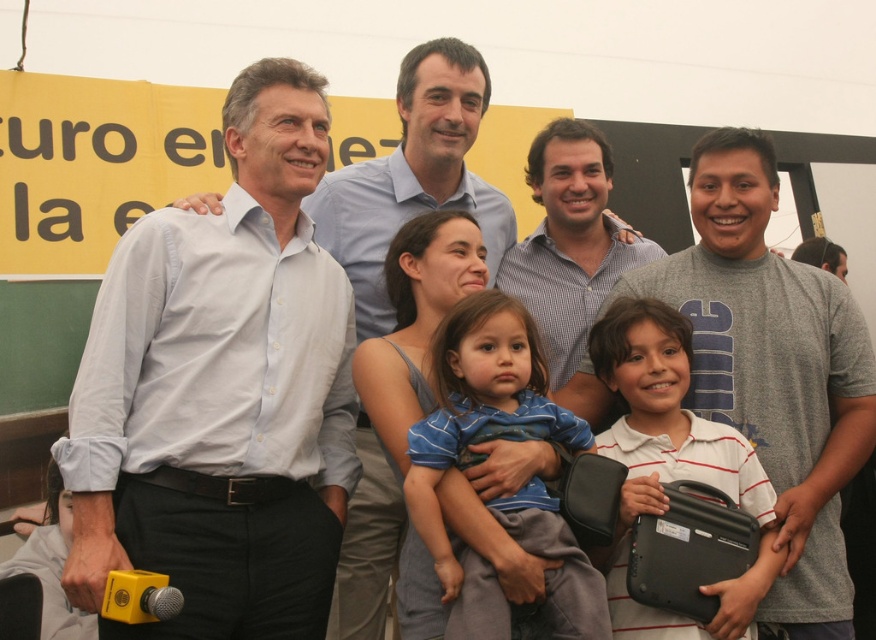
Question: Is white striped polo shirt at center further to the viewer compared to black matte briefcase at lower right?

Choices:
 (A) yes
 (B) no

Answer: (B)

Question: Is light blue shirt at center in front of gray cotton t-shirt at center?

Choices:
 (A) no
 (B) yes

Answer: (B)

Question: Which point is closer to the camera?

Choices:
 (A) white striped polo shirt at center
 (B) black matte briefcase at lower right

Answer: (A)

Question: Estimate the real-world distances between objects in this image. Which object is closer to the white shirt at center?

Choices:
 (A) white striped polo shirt at center
 (B) light blue shirt at center
 (C) checkered shirt at center
 (D) black matte briefcase at lower right

Answer: (C)

Question: Is light blue shirt at center smaller than black matte briefcase at lower right?

Choices:
 (A) yes
 (B) no

Answer: (B)

Question: Estimate the real-world distances between objects in this image. Which object is closer to the white striped polo shirt at center?

Choices:
 (A) white shirt at center
 (B) gray cotton t-shirt at center
 (C) checkered shirt at center

Answer: (B)